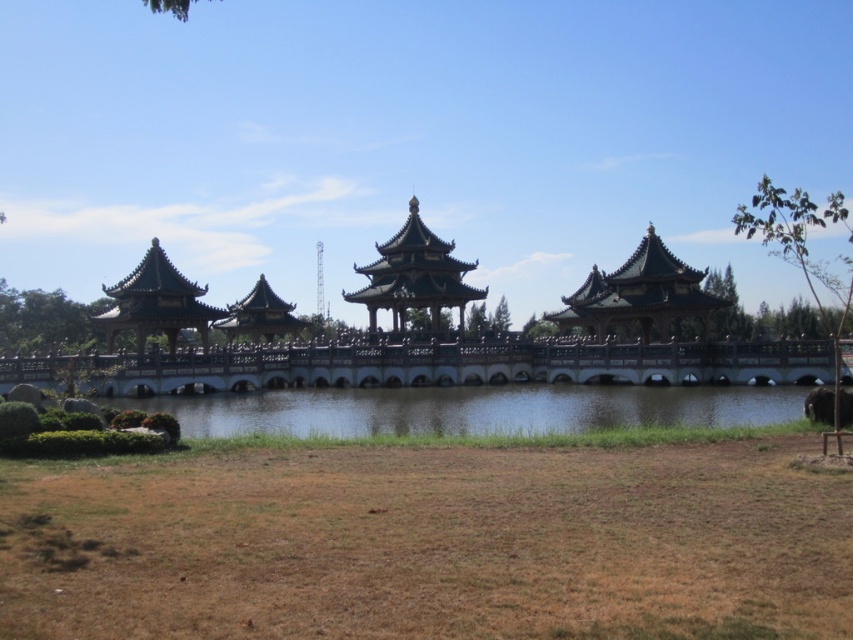
Question: Can you confirm if dark brown wooden bridge at center is positioned to the right of clear water at center?

Choices:
 (A) yes
 (B) no

Answer: (B)

Question: Is dark brown wooden bridge at center bigger than wooden pagoda at center?

Choices:
 (A) yes
 (B) no

Answer: (A)

Question: Which point appears farthest from the camera in this image?

Choices:
 (A) (506, 422)
 (B) (453, 282)
 (C) (38, 362)

Answer: (B)

Question: Which point is farther to the camera?

Choices:
 (A) wooden pagoda at center
 (B) dark brown wooden bridge at center
 (C) clear water at center

Answer: (A)

Question: Estimate the real-world distances between objects in this image. Which object is farther from the wooden pagoda at center?

Choices:
 (A) clear water at center
 (B) dark brown wooden bridge at center

Answer: (A)

Question: Does dark brown wooden bridge at center have a smaller size compared to clear water at center?

Choices:
 (A) yes
 (B) no

Answer: (B)